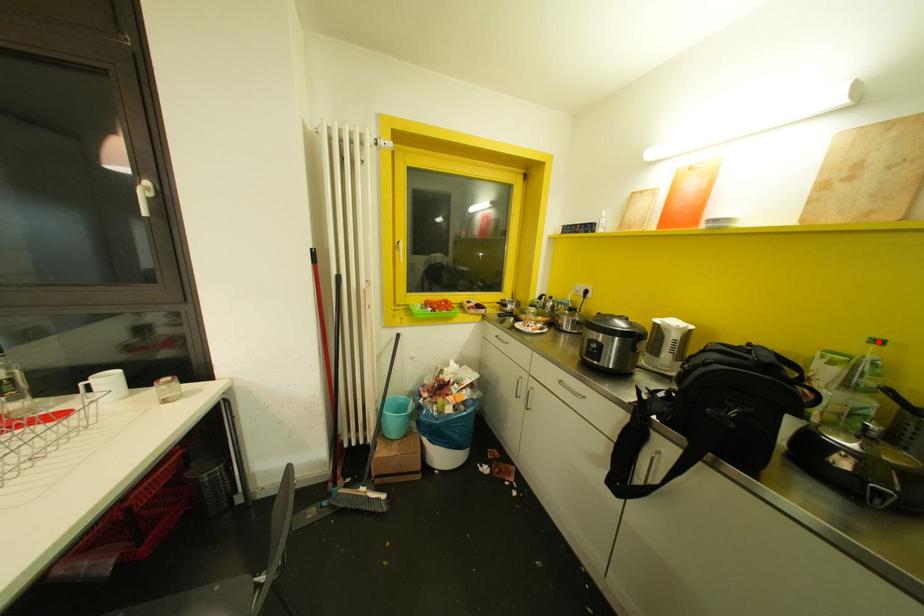
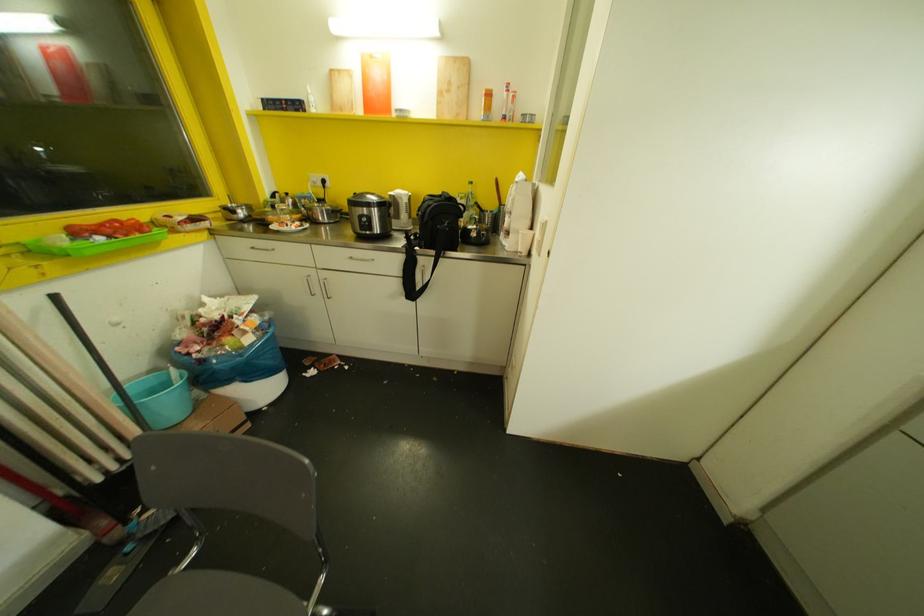
Locate, in the second image, the point that corresponds to the highlighted location in the first image.

(469, 182)